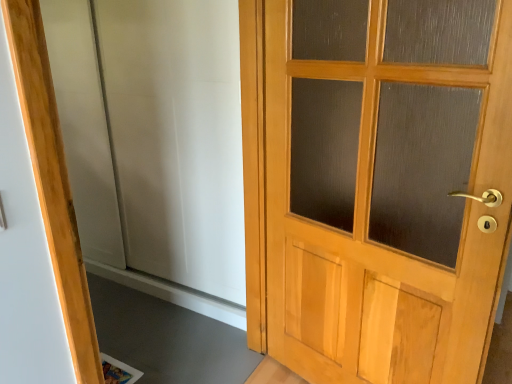
Question: Can you confirm if light wood/glass door at right is smaller than white matte elevator at center?

Choices:
 (A) no
 (B) yes

Answer: (B)

Question: Can you confirm if light wood/glass door at right is thinner than white matte elevator at center?

Choices:
 (A) yes
 (B) no

Answer: (B)

Question: From the image's perspective, would you say light wood/glass door at right is shown under white matte elevator at center?

Choices:
 (A) yes
 (B) no

Answer: (A)

Question: Does light wood/glass door at right have a larger size compared to white matte elevator at center?

Choices:
 (A) yes
 (B) no

Answer: (B)

Question: From a real-world perspective, is light wood/glass door at right positioned over white matte elevator at center based on gravity?

Choices:
 (A) no
 (B) yes

Answer: (A)

Question: Does light wood/glass door at right lie behind white matte elevator at center?

Choices:
 (A) yes
 (B) no

Answer: (B)

Question: Does white matte elevator at center have a larger size compared to light wood/glass door at right?

Choices:
 (A) no
 (B) yes

Answer: (B)

Question: Is white matte elevator at center positioned beyond the bounds of light wood/glass door at right?

Choices:
 (A) no
 (B) yes

Answer: (B)

Question: Does white matte elevator at center appear on the left side of light wood/glass door at right?

Choices:
 (A) yes
 (B) no

Answer: (A)

Question: Considering the relative sizes of white matte elevator at center and light wood/glass door at right in the image provided, is white matte elevator at center shorter than light wood/glass door at right?

Choices:
 (A) no
 (B) yes

Answer: (A)

Question: Is white matte elevator at center oriented away from light wood/glass door at right?

Choices:
 (A) yes
 (B) no

Answer: (B)

Question: From the image's perspective, is white matte elevator at center on top of light wood/glass door at right?

Choices:
 (A) yes
 (B) no

Answer: (A)

Question: Is point (74, 200) positioned closer to the camera than point (498, 64)?

Choices:
 (A) closer
 (B) farther

Answer: (B)